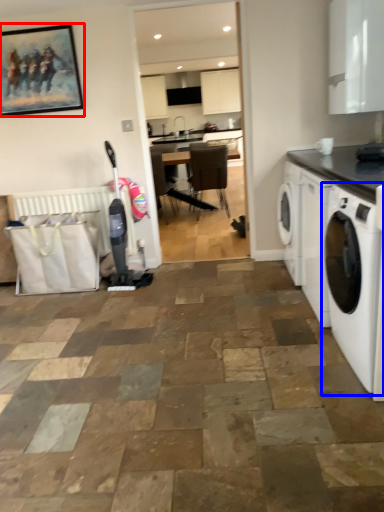
Question: Among these objects, which one is farthest to the camera, picture frame (highlighted by a red box) or washing machine (highlighted by a blue box)?

Choices:
 (A) picture frame
 (B) washing machine

Answer: (A)